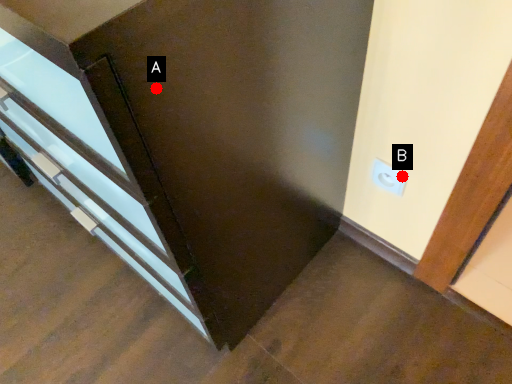
Question: Two points are circled on the image, labeled by A and B beside each circle. Which point appears closest to the camera in this image?

Choices:
 (A) A is closer
 (B) B is closer

Answer: (A)